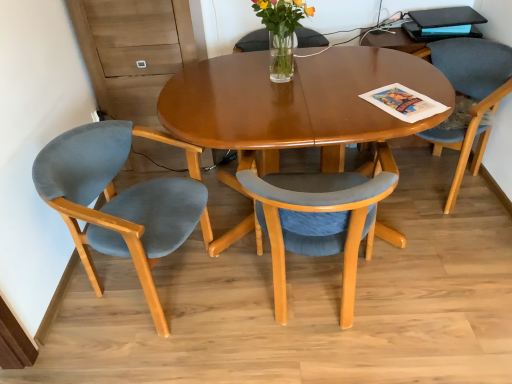
Question: Could you tell me if clear glass vase at center is turned towards translucent glass vase at center?

Choices:
 (A) no
 (B) yes

Answer: (B)

Question: Is clear glass vase at center shorter than translucent glass vase at center?

Choices:
 (A) yes
 (B) no

Answer: (A)

Question: From a real-world perspective, is clear glass vase at center located higher than translucent glass vase at center?

Choices:
 (A) no
 (B) yes

Answer: (A)

Question: Is clear glass vase at center bigger than translucent glass vase at center?

Choices:
 (A) yes
 (B) no

Answer: (B)

Question: Is clear glass vase at center to the right of translucent glass vase at center from the viewer's perspective?

Choices:
 (A) no
 (B) yes

Answer: (B)

Question: Is translucent glass vase at center at the back of clear glass vase at center?

Choices:
 (A) no
 (B) yes

Answer: (A)

Question: Does blue glossy magazine at upper right appear on the right side of gray fabric chair at right, the third chair in the left-to-right sequence?

Choices:
 (A) no
 (B) yes

Answer: (B)

Question: From the image's perspective, is blue glossy magazine at upper right located beneath gray fabric chair at right, the 1th chair viewed from the right?

Choices:
 (A) yes
 (B) no

Answer: (B)

Question: From a real-world perspective, is blue glossy magazine at upper right on top of gray fabric chair at right, the third chair in the left-to-right sequence?

Choices:
 (A) yes
 (B) no

Answer: (A)

Question: Is blue glossy magazine at upper right bigger than gray fabric chair at right, the 1th chair viewed from the right?

Choices:
 (A) yes
 (B) no

Answer: (B)

Question: Does blue glossy magazine at upper right have a greater height compared to gray fabric chair at right, the 1th chair viewed from the right?

Choices:
 (A) yes
 (B) no

Answer: (B)

Question: Can you confirm if blue glossy magazine at upper right is smaller than gray fabric chair at right, the 1th chair viewed from the right?

Choices:
 (A) no
 (B) yes

Answer: (B)

Question: Does matte blue chair at left, marked as the third chair in a right-to-left arrangement, turn towards clear glass vase at center?

Choices:
 (A) yes
 (B) no

Answer: (B)